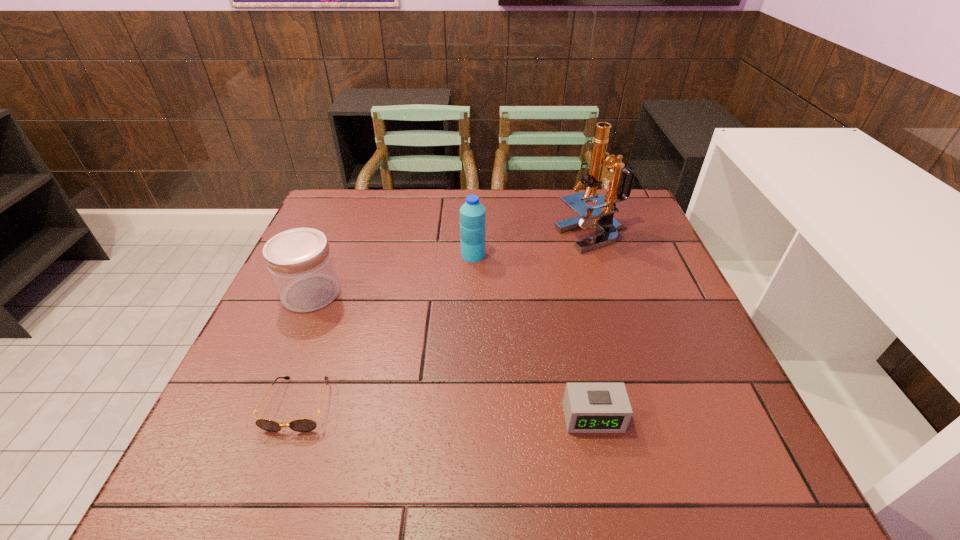
Where is `microscope`? The height and width of the screenshot is (540, 960). microscope is located at coordinates (619, 181).

At what (x,y) coordinates should I click in order to perform the action: click on water bottle. Please return your answer as a coordinate pair (x, y). The image size is (960, 540). Looking at the image, I should click on (472, 213).

The height and width of the screenshot is (540, 960). Identify the location of the second tallest object. (472, 213).

I want to click on the third farthest object, so click(300, 263).

Identify the location of jar. (300, 263).

The height and width of the screenshot is (540, 960). What are the coordinates of `the fourth tallest object` in the screenshot? It's located at (588, 407).

Where is `sunglasses`? sunglasses is located at coordinates (299, 425).

You are a GUI agent. You are given a task and a screenshot of the screen. Output one action in this format:
    pyautogui.click(x=<x>, y=<y>)
    Task: Click on the vacant space situated 0.270m at the eyepiece of the tallest object
    Image resolution: width=960 pixels, height=540 pixels.
    Given the screenshot: What is the action you would take?
    pyautogui.click(x=462, y=236)

Find the location of a particular element. The image size is (960, 540). free spot located 0.160m at the eyepiece of the tallest object is located at coordinates (500, 236).

I want to click on vacant space located at the eyepiece of the tallest object, so [x=496, y=236].